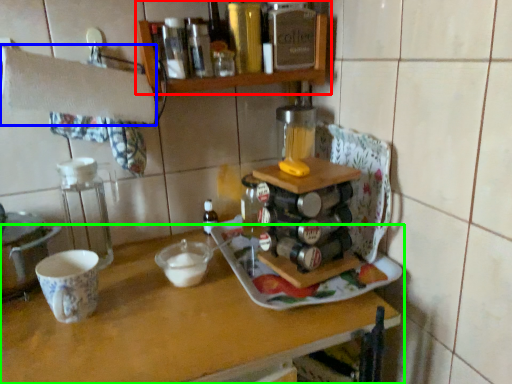
Question: Estimate the real-world distances between objects in this image. Which object is farther from shelf (highlighted by a red box), towel bar (highlighted by a blue box) or table (highlighted by a green box)?

Choices:
 (A) towel bar
 (B) table

Answer: (B)